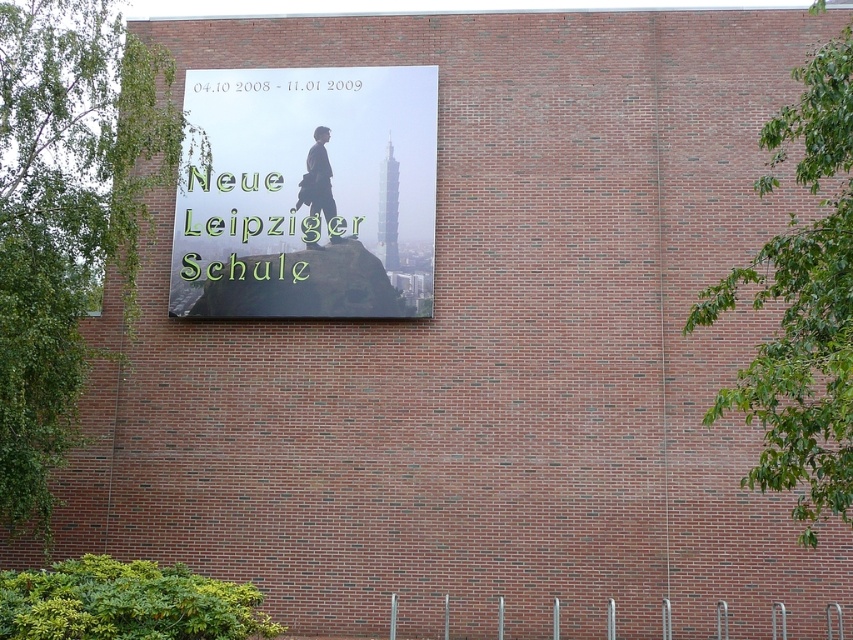
Can you confirm if matte glass sign at center is bigger than matte black suit at center?

Yes.

Where is `matte glass sign at center`? matte glass sign at center is located at coordinates (308, 195).